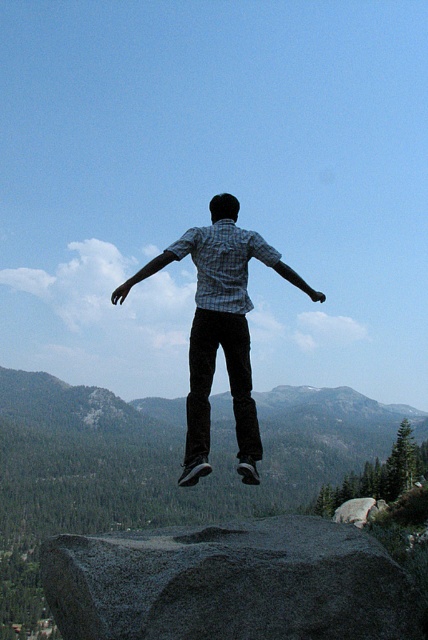
Is gray rough rock at center below checkered shirt at center?

Correct, gray rough rock at center is located below checkered shirt at center.

Between gray rough rock at center and checkered shirt at center, which one appears on the left side from the viewer's perspective?

gray rough rock at center is more to the left.

Who is more distant from viewer, [302,584] or [243,326]?

Point [243,326]

The image size is (428, 640). I want to click on gray rough rock at center, so click(x=229, y=582).